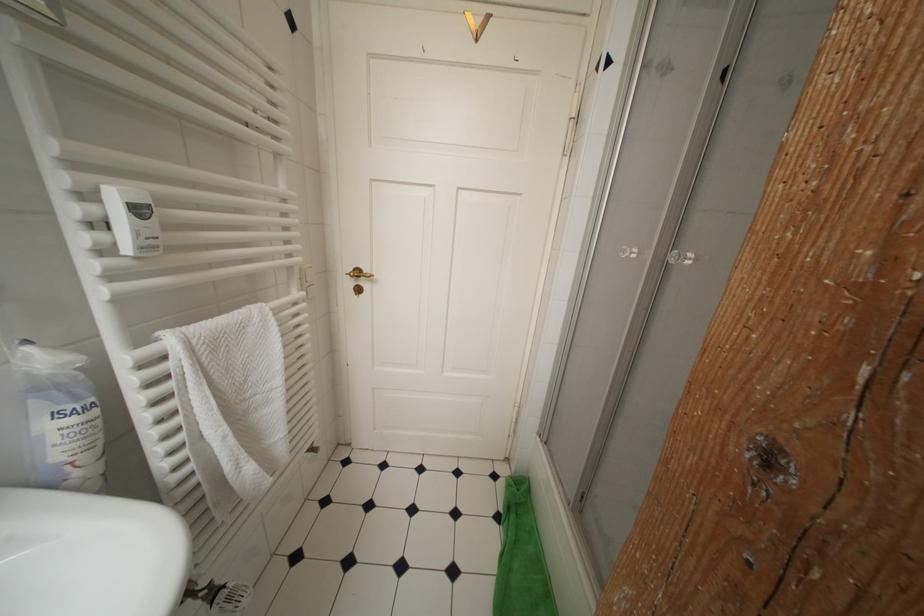
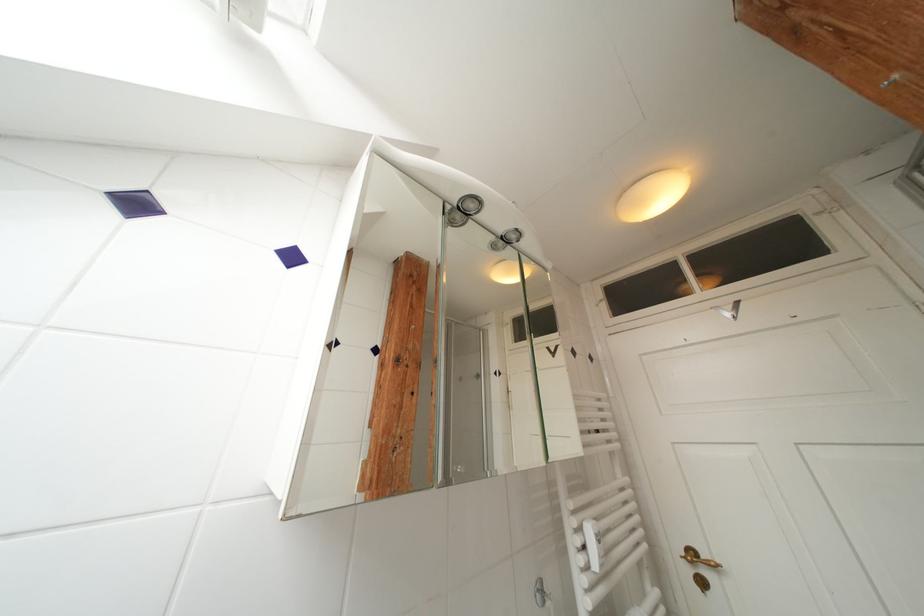
Where in the second image is the point corresponding to point (365, 276) from the first image?

(699, 557)